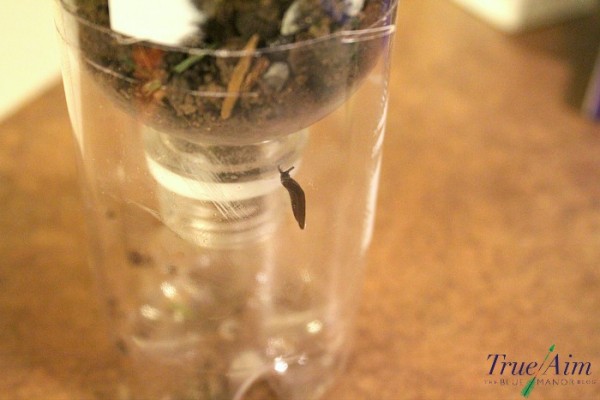
Identify the location of plastic cup bottom indent. (261, 376).